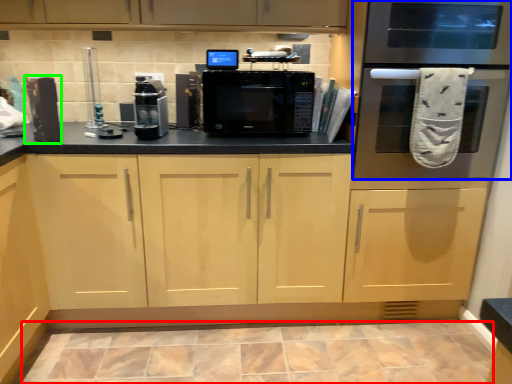
Question: Which object is the farthest from ceramic tile (highlighted by a red box)? Choose among these: oven (highlighted by a blue box) or appliance (highlighted by a green box).

Choices:
 (A) oven
 (B) appliance

Answer: (B)